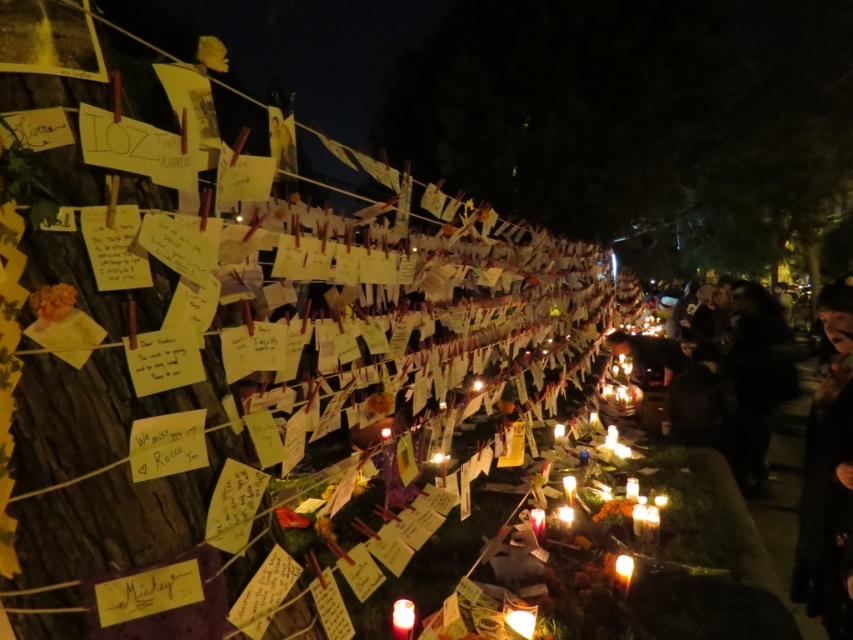
Is translucent wax candle at lower center further to camera compared to translucent wax candle at lower right?

No, translucent wax candle at lower center is in front of translucent wax candle at lower right.

Who is lower down, translucent wax candle at lower center or translucent wax candle at lower right?

translucent wax candle at lower right is lower down.

The width and height of the screenshot is (853, 640). What are the coordinates of `translucent wax candle at lower center` in the screenshot? It's located at (402, 618).